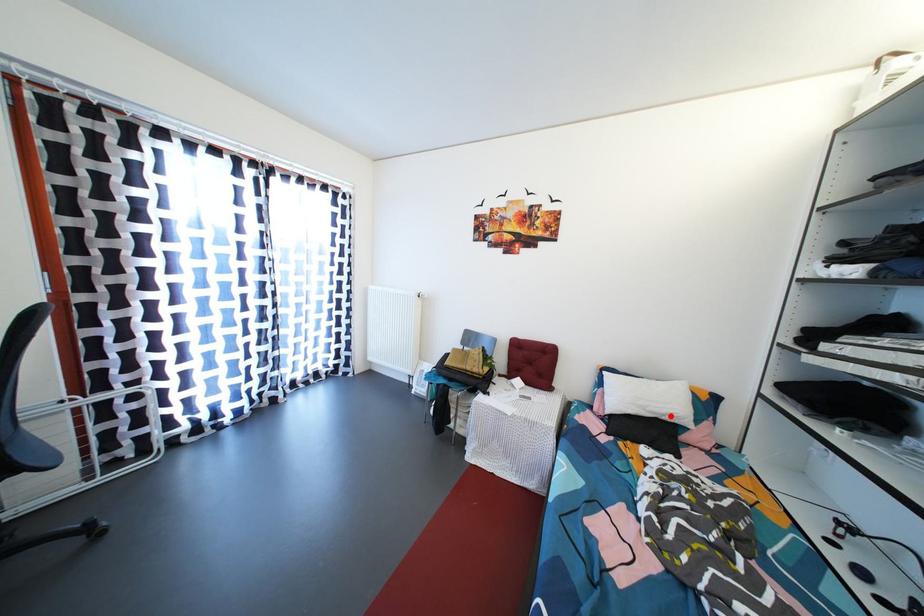
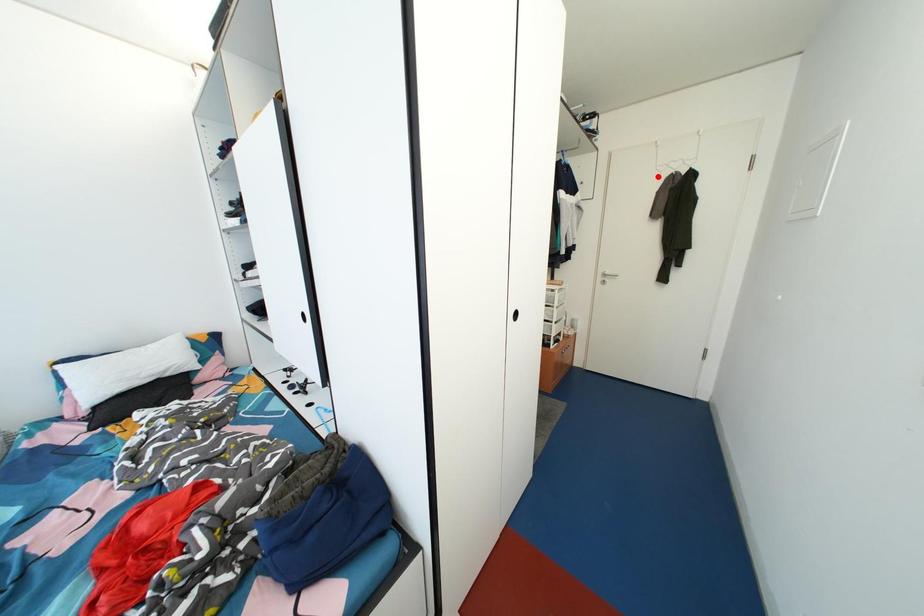
I am providing you with two images of the same scene from different viewpoints. A red point is marked on the first image and another point is marked on the second image. Is the red point in image1 aligned with the point shown in image2?

No